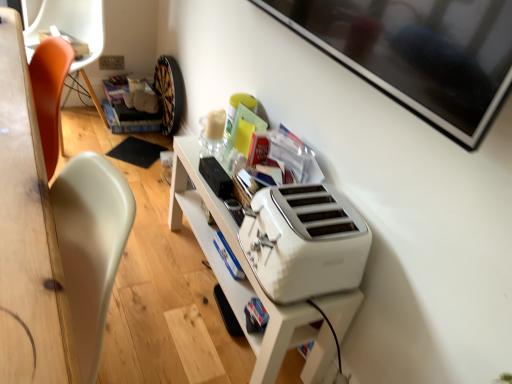
Question: Is white plastic toaster at lower center wider or thinner than orange plastic chair at left?

Choices:
 (A) thin
 (B) wide

Answer: (A)

Question: Is white plastic toaster at lower center inside the boundaries of orange plastic chair at left, or outside?

Choices:
 (A) outside
 (B) inside

Answer: (A)

Question: From the image's perspective, is white plastic toaster at lower center positioned above or below orange plastic chair at left?

Choices:
 (A) below
 (B) above

Answer: (A)

Question: In terms of height, does orange plastic chair at left look taller or shorter compared to white plastic toaster at lower center?

Choices:
 (A) short
 (B) tall

Answer: (B)

Question: From a real-world perspective, relative to white plastic toaster at lower center, is orange plastic chair at left vertically above or below?

Choices:
 (A) below
 (B) above

Answer: (A)

Question: In the image, is orange plastic chair at left positioned in front of or behind white plastic toaster at lower center?

Choices:
 (A) behind
 (B) front

Answer: (A)

Question: Does point (83, 19) appear closer or farther from the camera than point (278, 187)?

Choices:
 (A) farther
 (B) closer

Answer: (A)